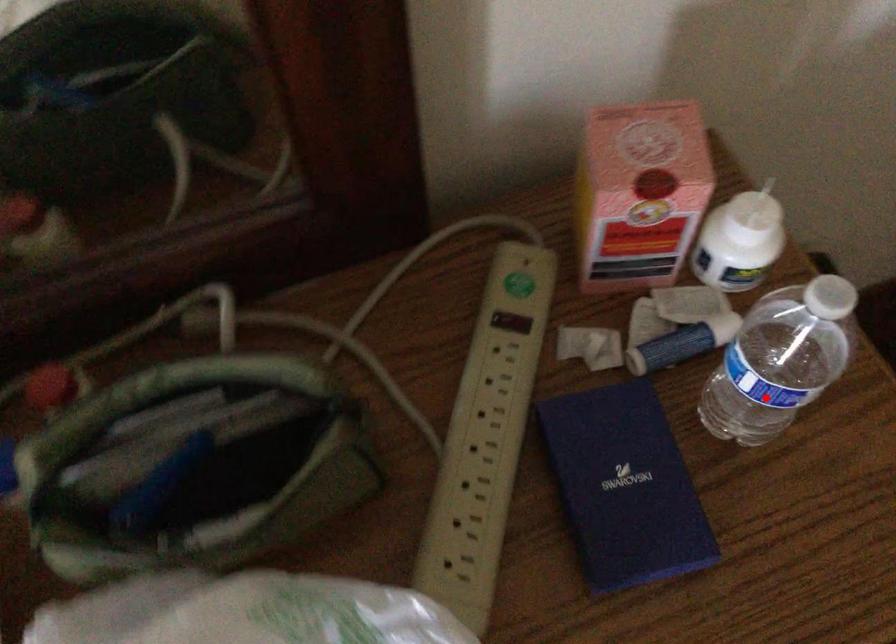
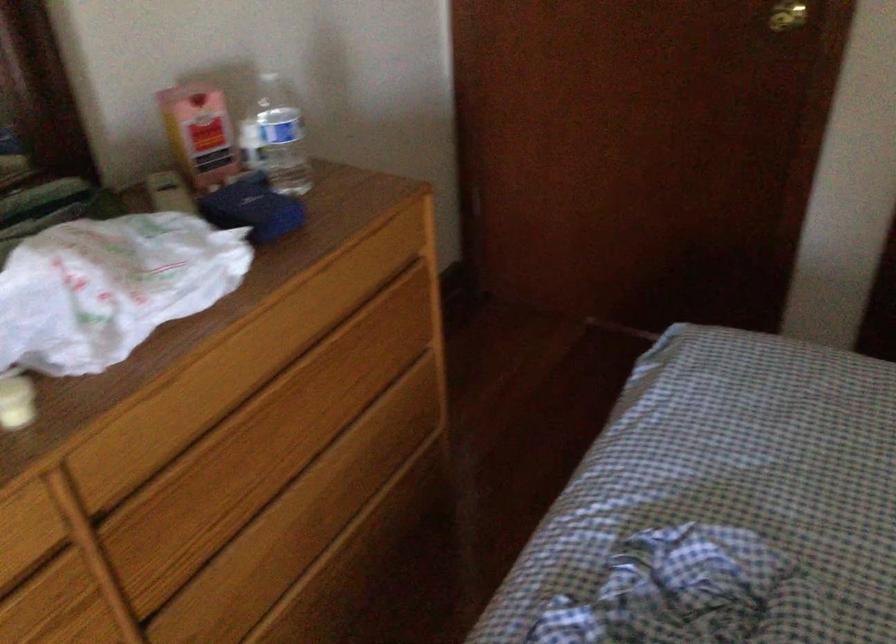
Question: I am providing you with two images of the same scene from different viewpoints. A red point is shown in image1. For the corresponding object point in image2, is it positioned nearer or farther from the camera?

Choices:
 (A) Nearer
 (B) Farther

Answer: (B)